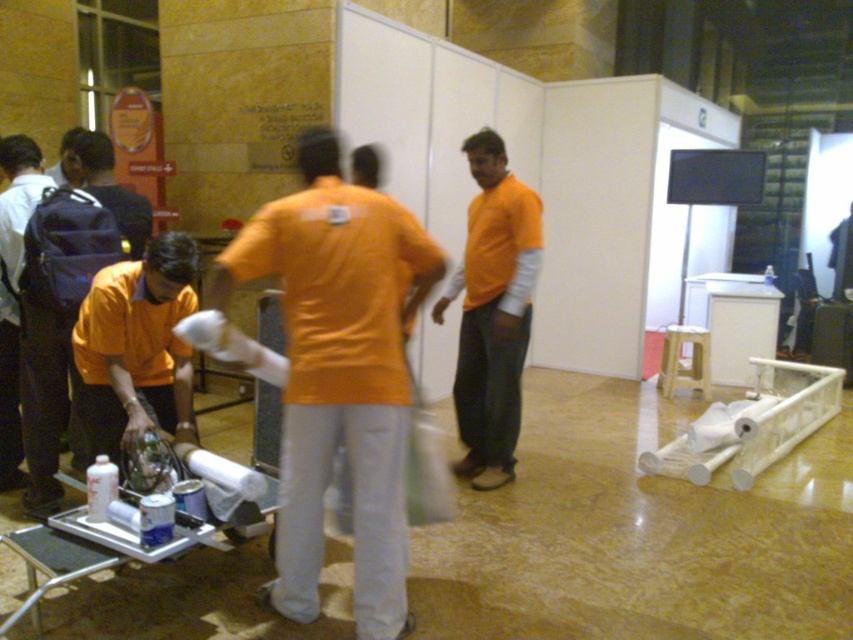
You are a visitor at this event and need to locate the staff member wearing the orange matte shirt at center. From your position facing the scene, which direction should you look relative to the matte black backpack at left?

The orange matte shirt at center is to the right of the matte black backpack at left, so you should look to the right of the matte black backpack at left to find the staff member.

You are standing in the conference hall and need to find the matte orange shirt at left. According to the coordinates provided, where should you look relative to your current position?

The matte orange shirt at left is located at point 0.542 on the x axis and 0.162 on the y axis, so you should look towards the upper right direction from your current position.

In the scene shown: You are a visitor in the conference hall and see the matte orange shirt at left and the matte black backpack at left. Which object is closer to your right side?

The matte orange shirt at left is closer to your right side since it is positioned to the right of the matte black backpack at left.